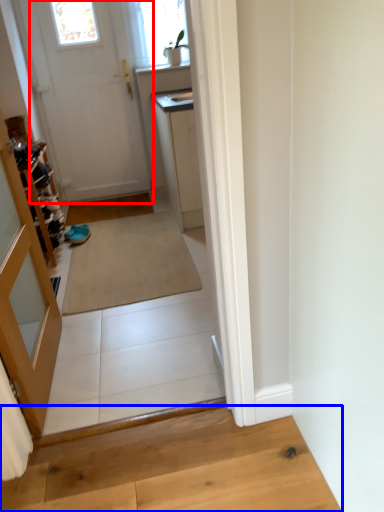
Question: Which of the following is the closest to the observer, door (highlighted by a red box) or hardwood (highlighted by a blue box)?

Choices:
 (A) door
 (B) hardwood

Answer: (B)